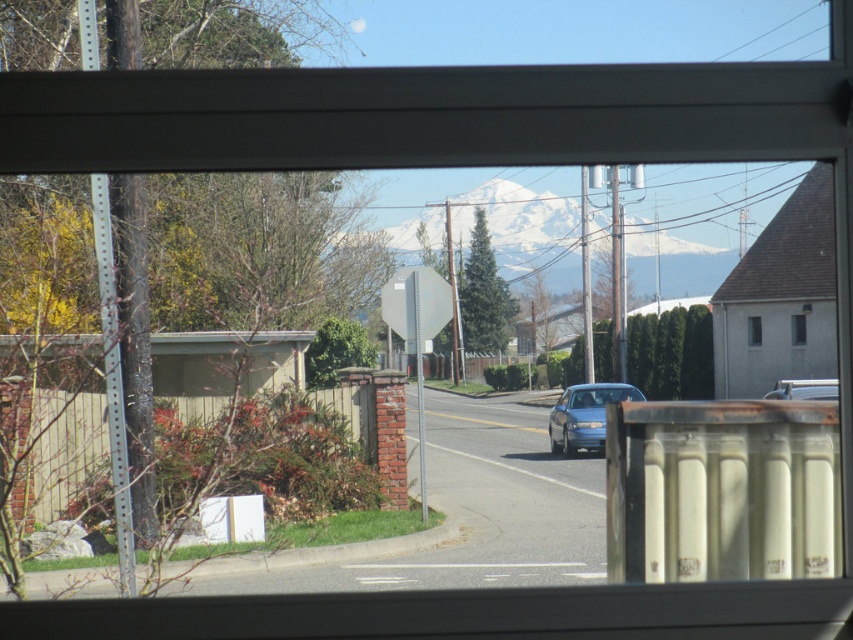
Does point (715, 220) come in front of point (415, 316)?

No, it is not.

Measure the distance between white snow-covered mountain at center and metallic gray stop sign at center.

white snow-covered mountain at center is 32.17 meters from metallic gray stop sign at center.

Which is behind, point (434, 198) or point (405, 348)?

The point (434, 198) is behind.

Find the location of a particular element. The image size is (853, 640). white snow-covered mountain at center is located at coordinates (488, 220).

Can you confirm if metallic gray stop sign at center is smaller than white matte window at upper right?

Incorrect, metallic gray stop sign at center is not smaller in size than white matte window at upper right.

Is metallic gray stop sign at center positioned before white matte window at upper right?

Yes, it is in front of white matte window at upper right.

Which is in front, point (442, 298) or point (798, 344)?

Positioned in front is point (442, 298).

Identify the location of metallic gray stop sign at center. The image size is (853, 640). (416, 330).

Does point (831, 388) come in front of point (793, 332)?

That is True.

Does metallic silver car at center have a greater width compared to white matte window at upper right?

Indeed, metallic silver car at center has a greater width compared to white matte window at upper right.

What do you see at coordinates (804, 388) in the screenshot? I see `metallic silver car at center` at bounding box center [804, 388].

The width and height of the screenshot is (853, 640). Find the location of `metallic silver car at center`. metallic silver car at center is located at coordinates (804, 388).